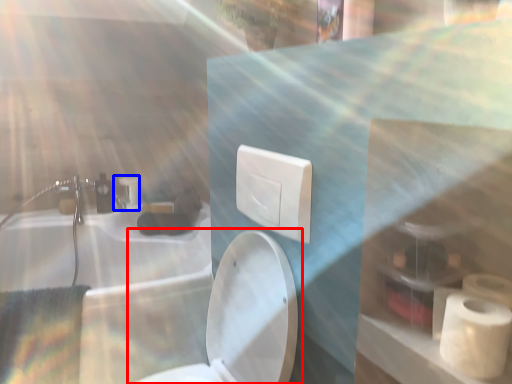
Question: Which of the following is the closest to the observer, toilet (highlighted by a red box) or faucet (highlighted by a blue box)?

Choices:
 (A) toilet
 (B) faucet

Answer: (A)